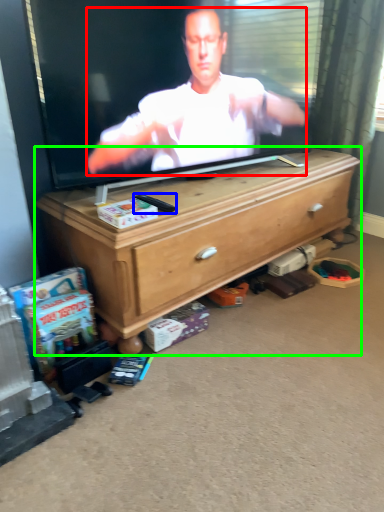
Question: Considering the real-world distances, which object is closest to person (highlighted by a red box)? remote control (highlighted by a blue box) or chest of drawers (highlighted by a green box).

Choices:
 (A) remote control
 (B) chest of drawers

Answer: (B)